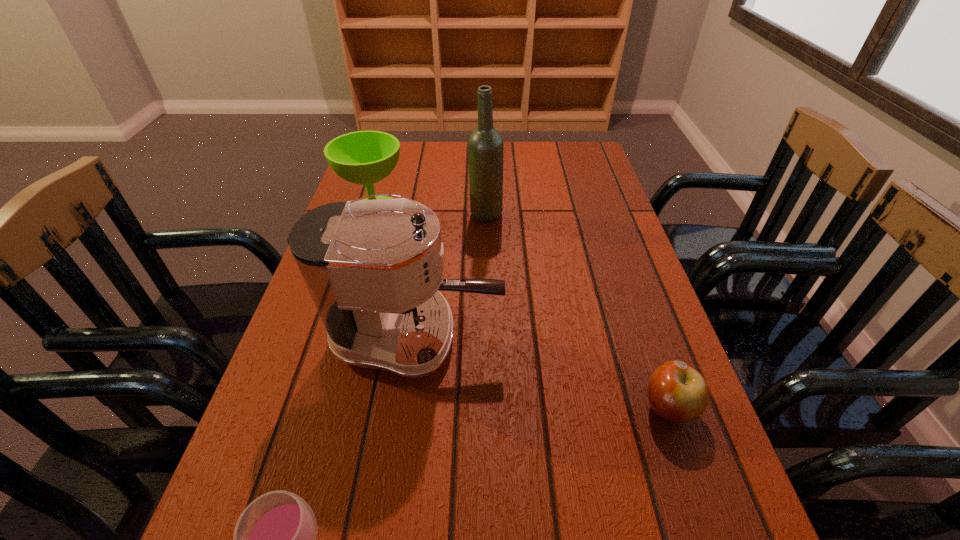
This screenshot has width=960, height=540. I want to click on wine bottle, so click(485, 145).

At what (x,y) coordinates should I click in order to perform the action: click on coffee maker. Please return your answer as a coordinate pair (x, y). The width and height of the screenshot is (960, 540). Looking at the image, I should click on (373, 268).

You are a GUI agent. You are given a task and a screenshot of the screen. Output one action in this format:
    pyautogui.click(x=<x>, y=<y>)
    Task: Click on the farther wineglass
    
    Given the screenshot: What is the action you would take?
    pyautogui.click(x=364, y=157)

The image size is (960, 540). Find the location of `apple`. apple is located at coordinates (677, 392).

This screenshot has width=960, height=540. In order to click on the rightmost object in this screenshot , I will do `click(677, 392)`.

Image resolution: width=960 pixels, height=540 pixels. Identify the location of vacant space located on the front of the wine bottle. (488, 319).

Where is `free location located on the front-facing side of the coffee maker`? The width and height of the screenshot is (960, 540). free location located on the front-facing side of the coffee maker is located at coordinates (527, 338).

Locate an element on the screen. This screenshot has width=960, height=540. free point located on the back of the farther wineglass is located at coordinates (393, 157).

At what (x,y) coordinates should I click in order to perform the action: click on free spot located on the front of the shortest object. Please return your answer as a coordinate pair (x, y). Image resolution: width=960 pixels, height=540 pixels. Looking at the image, I should click on (700, 497).

At what (x,y) coordinates should I click in order to perform the action: click on coffee maker situated at the left edge. Please return your answer as a coordinate pair (x, y). Looking at the image, I should click on pyautogui.click(x=373, y=268).